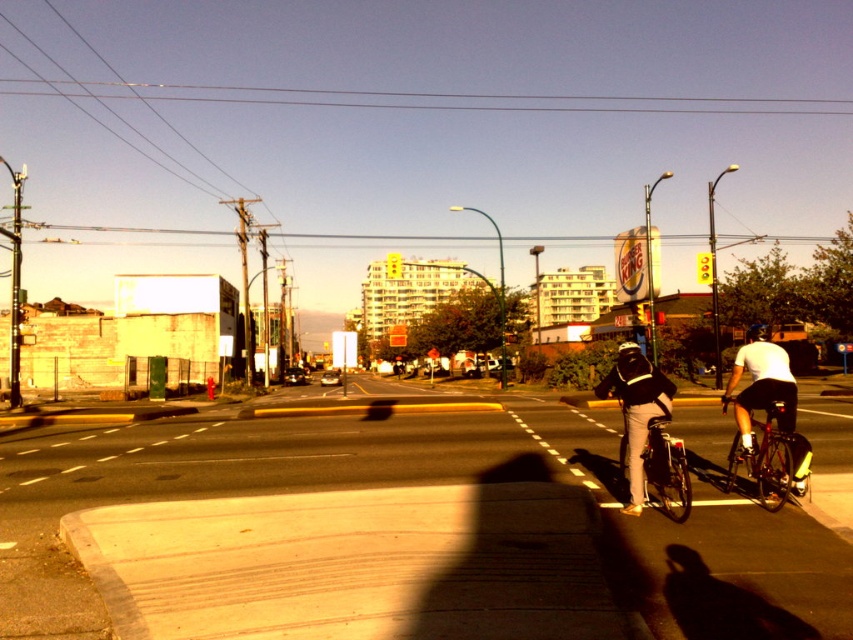
Between shiny black bicycle at right and black matte bicycle helmet at center, which one appears on the right side from the viewer's perspective?

From the viewer's perspective, black matte bicycle helmet at center appears more on the right side.

Who is higher up, shiny black bicycle at right or black matte bicycle helmet at center?

black matte bicycle helmet at center is higher up.

Between point (775, 449) and point (618, 349), which one is positioned behind?

The point (618, 349) is behind.

The width and height of the screenshot is (853, 640). Find the location of `shiny black bicycle at right`. shiny black bicycle at right is located at coordinates (770, 460).

Looking at this image, does shiny black bicycle at center appear on the right side of shiny black bicycle at right?

In fact, shiny black bicycle at center is to the left of shiny black bicycle at right.

Is point (685, 467) farther from viewer compared to point (801, 480)?

No, (685, 467) is in front of (801, 480).

Where is `shiny black bicycle at center`? Image resolution: width=853 pixels, height=640 pixels. shiny black bicycle at center is located at coordinates (656, 461).

Which of these two, shiny black bicycle at center or black matte bicycle helmet at center, stands shorter?

black matte bicycle helmet at center is shorter.

Between point (656, 460) and point (624, 349), which one is positioned in front?

Point (656, 460) is in front.

At what (x,y) coordinates should I click in order to perform the action: click on shiny black bicycle at center. Please return your answer as a coordinate pair (x, y). This screenshot has width=853, height=640. Looking at the image, I should click on (656, 461).